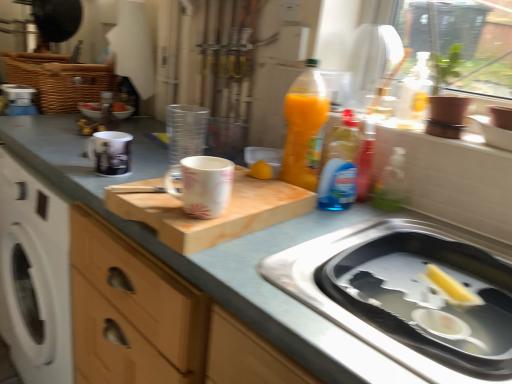
This screenshot has width=512, height=384. I want to click on free point to the right of wooden cutting board at center, so click(x=333, y=230).